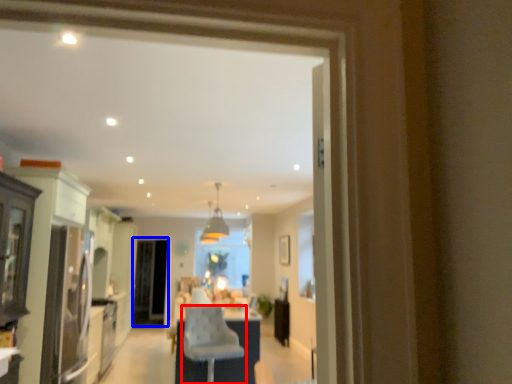
Question: Which object is closer to the camera taking this photo, chair (highlighted by a red box) or screen door (highlighted by a blue box)?

Choices:
 (A) chair
 (B) screen door

Answer: (A)